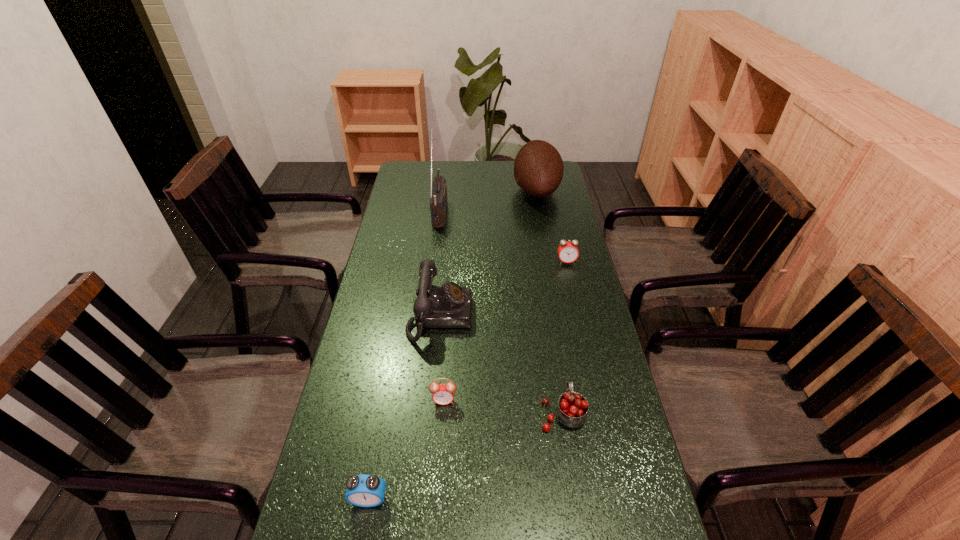
Locate an element on the screen. vacant space that satisfies the following two spatial constraints: 1. on the front-facing side of the tallest object; 2. on the face of the leftmost alarm clock is located at coordinates (406, 499).

Where is `vacant area in the image that satisfies the following two spatial constraints: 1. on the front-facing side of the farthest alarm clock; 2. on the dial of the telephone`? vacant area in the image that satisfies the following two spatial constraints: 1. on the front-facing side of the farthest alarm clock; 2. on the dial of the telephone is located at coordinates (579, 316).

Where is `free spot that satisfies the following two spatial constraints: 1. on the dial of the fifth shortest object; 2. on the face of the leftmost alarm clock`? The image size is (960, 540). free spot that satisfies the following two spatial constraints: 1. on the dial of the fifth shortest object; 2. on the face of the leftmost alarm clock is located at coordinates (423, 499).

You are a GUI agent. You are given a task and a screenshot of the screen. Output one action in this format:
    pyautogui.click(x=<x>, y=<y>)
    Task: Click on the vacant space that satisfies the following two spatial constraints: 1. on the dial of the fourth nearest object; 2. on the handle side of the cherry
    
    Given the screenshot: What is the action you would take?
    pyautogui.click(x=431, y=413)

The image size is (960, 540). What are the coordinates of `vacant space that satisfies the following two spatial constraints: 1. on the dial of the fourth nearest object; 2. on the face of the nearest object` in the screenshot? It's located at (423, 499).

What are the coordinates of `free location that satisfies the following two spatial constraints: 1. on the handle side of the fourth shortest object; 2. on the front-facing side of the tallest object` in the screenshot? It's located at (531, 211).

Where is `vacant space that satisfies the following two spatial constraints: 1. on the front-facing side of the radio receiver; 2. on the face of the nearest alarm clock`? Image resolution: width=960 pixels, height=540 pixels. vacant space that satisfies the following two spatial constraints: 1. on the front-facing side of the radio receiver; 2. on the face of the nearest alarm clock is located at coordinates (406, 499).